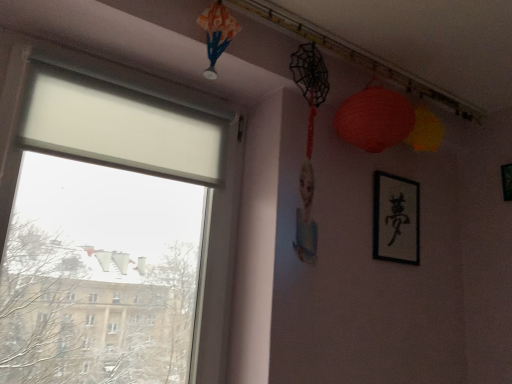
Question: Is black matte picture frame at upper right, the 2th picture frame in the left-to-right sequence, shorter than black paper at upper right, which is counted as the second picture frame, starting from the right?

Choices:
 (A) no
 (B) yes

Answer: (B)

Question: Is black matte picture frame at upper right, the 2th picture frame in the left-to-right sequence, in front of black paper at upper right, the first picture frame when ordered from left to right?

Choices:
 (A) no
 (B) yes

Answer: (A)

Question: Does black matte picture frame at upper right, the 2th picture frame in the left-to-right sequence, have a greater height compared to black paper at upper right, the first picture frame when ordered from left to right?

Choices:
 (A) yes
 (B) no

Answer: (B)

Question: Is black matte picture frame at upper right, the 1th picture frame when ordered from right to left, looking in the opposite direction of black paper at upper right, which is counted as the second picture frame, starting from the right?

Choices:
 (A) yes
 (B) no

Answer: (B)

Question: Is black matte picture frame at upper right, the 1th picture frame when ordered from right to left, at the right side of black paper at upper right, the first picture frame when ordered from left to right?

Choices:
 (A) yes
 (B) no

Answer: (A)

Question: From the image's perspective, is black paper at upper right, which is counted as the second picture frame, starting from the right, positioned above or below matte paper lantern at upper right?

Choices:
 (A) below
 (B) above

Answer: (A)

Question: In terms of size, does black paper at upper right, which is counted as the second picture frame, starting from the right, appear bigger or smaller than matte paper lantern at upper right?

Choices:
 (A) small
 (B) big

Answer: (A)

Question: In the image, is black paper at upper right, which is counted as the second picture frame, starting from the right, positioned in front of or behind matte paper lantern at upper right?

Choices:
 (A) behind
 (B) front

Answer: (A)

Question: Considering the positions of point (406, 210) and point (335, 117), is point (406, 210) closer or farther from the camera than point (335, 117)?

Choices:
 (A) farther
 (B) closer

Answer: (A)

Question: Considering the positions of black paper at upper right, the first picture frame when ordered from left to right, and black matte picture frame at upper right, the 2th picture frame in the left-to-right sequence, in the image, is black paper at upper right, the first picture frame when ordered from left to right, bigger or smaller than black matte picture frame at upper right, the 2th picture frame in the left-to-right sequence,?

Choices:
 (A) big
 (B) small

Answer: (A)

Question: Would you say black paper at upper right, the first picture frame when ordered from left to right, is to the left or to the right of black matte picture frame at upper right, the 2th picture frame in the left-to-right sequence, in the picture?

Choices:
 (A) left
 (B) right

Answer: (A)

Question: Considering their positions, is black paper at upper right, which is counted as the second picture frame, starting from the right, located in front of or behind black matte picture frame at upper right, the 1th picture frame when ordered from right to left?

Choices:
 (A) front
 (B) behind

Answer: (A)

Question: From a real-world perspective, is black paper at upper right, the first picture frame when ordered from left to right, positioned above or below black matte picture frame at upper right, the 2th picture frame in the left-to-right sequence?

Choices:
 (A) above
 (B) below

Answer: (B)

Question: In terms of size, does matte paper lantern at upper right appear bigger or smaller than black matte picture frame at upper right, the 1th picture frame when ordered from right to left?

Choices:
 (A) big
 (B) small

Answer: (A)

Question: Is matte paper lantern at upper right to the left or to the right of black matte picture frame at upper right, the 2th picture frame in the left-to-right sequence, in the image?

Choices:
 (A) right
 (B) left

Answer: (B)